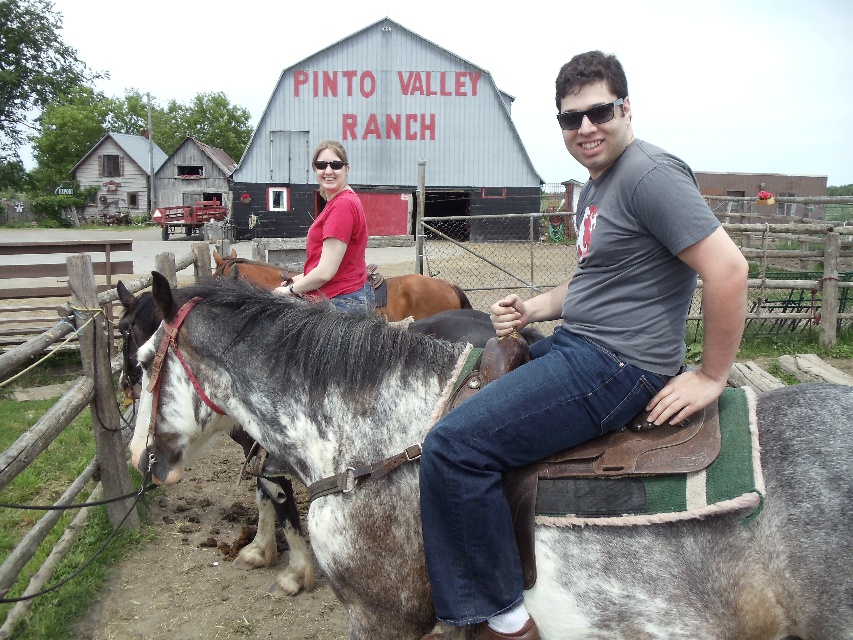
You are a photographer standing at the entrance of Pinto Valley Ranch. You want to take a picture of the speckled leather saddle at center. Given that the entrance is at point 0,0 and the barn is at 1,1, where should you position yourself to capture the saddle in the frame?

The speckled leather saddle at center is located at point (723,547). Since the entrance is at (0,0) and the barn is at (852,639), you should position yourself near the entrance but closer to the barn to capture the saddle in the frame.

Based on the photo, you are a photographer trying to capture a closeup shot of the sunglasses at upper center while also including the speckled leather saddle at center in the frame. Given that your camera has a maximum focus range of 1.5 meters, will you be able to capture both objects in focus?

The speckled leather saddle at center is 1.36 meters from sunglasses at upper center. Since the distance between them is within the camera maximum focus range of 1.5 meters, you can capture both objects in focus.